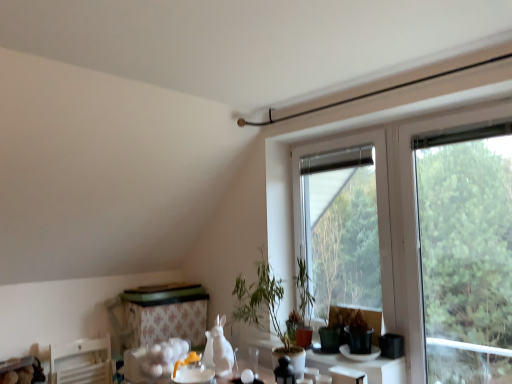
Question: Is green leafy tree at right smaller than floral-patterned fabric at lower center?

Choices:
 (A) no
 (B) yes

Answer: (A)

Question: Can you confirm if green leafy tree at right is bigger than floral-patterned fabric at lower center?

Choices:
 (A) yes
 (B) no

Answer: (A)

Question: Considering the relative sizes of green leafy tree at right and floral-patterned fabric at lower center in the image provided, is green leafy tree at right shorter than floral-patterned fabric at lower center?

Choices:
 (A) no
 (B) yes

Answer: (A)

Question: Are green leafy tree at right and floral-patterned fabric at lower center located far from each other?

Choices:
 (A) yes
 (B) no

Answer: (A)

Question: Is floral-patterned fabric at lower center at the back of green leafy tree at right?

Choices:
 (A) yes
 (B) no

Answer: (B)

Question: Is green matte plant at center bigger or smaller than transparent glass vase at lower center?

Choices:
 (A) small
 (B) big

Answer: (B)

Question: From the image's perspective, is green matte plant at center positioned above or below transparent glass vase at lower center?

Choices:
 (A) below
 (B) above

Answer: (B)

Question: Is point (x=244, y=301) closer or farther from the camera than point (x=271, y=359)?

Choices:
 (A) farther
 (B) closer

Answer: (A)

Question: Do you think green matte plant at center is within transparent glass vase at lower center, or outside of it?

Choices:
 (A) outside
 (B) inside

Answer: (A)

Question: Which is correct: transparent glass vase at lower center is inside green leafy tree at right, or outside of it?

Choices:
 (A) inside
 (B) outside

Answer: (B)

Question: In terms of width, does transparent glass vase at lower center look wider or thinner when compared to green leafy tree at right?

Choices:
 (A) thin
 (B) wide

Answer: (B)

Question: Would you say transparent glass vase at lower center is to the left or to the right of green leafy tree at right in the picture?

Choices:
 (A) right
 (B) left

Answer: (B)

Question: Is point (289, 350) positioned closer to the camera than point (481, 155)?

Choices:
 (A) closer
 (B) farther

Answer: (A)

Question: Is transparent glass window at center in front of or behind floral-patterned fabric at lower center in the image?

Choices:
 (A) behind
 (B) front

Answer: (B)

Question: From the image's perspective, relative to floral-patterned fabric at lower center, is transparent glass window at center above or below?

Choices:
 (A) above
 (B) below

Answer: (A)